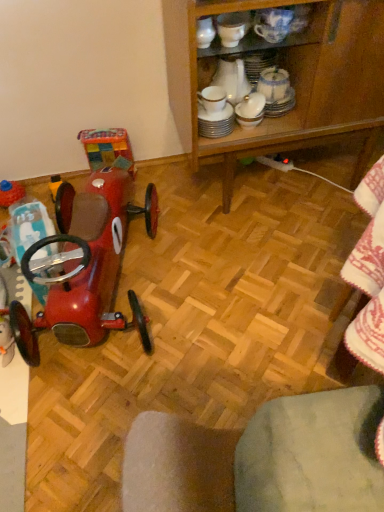
Question: From a real-world perspective, is shiny red car at left, the 1th toy from the left, under wooden cabinet at center?

Choices:
 (A) no
 (B) yes

Answer: (B)

Question: Does shiny red car at left, which ranks as the second toy in right-to-left order, have a lesser height compared to wooden cabinet at center?

Choices:
 (A) no
 (B) yes

Answer: (B)

Question: Is shiny red car at left, the second toy viewed from the front, outside of wooden cabinet at center?

Choices:
 (A) no
 (B) yes

Answer: (B)

Question: Is shiny red car at left, which is counted as the 1th toy, starting from the back, looking in the opposite direction of wooden cabinet at center?

Choices:
 (A) no
 (B) yes

Answer: (A)

Question: Can you confirm if shiny red car at left, the second toy viewed from the front, is taller than wooden cabinet at center?

Choices:
 (A) yes
 (B) no

Answer: (B)

Question: Considering the positions of wooden cabinet at center and shiny red car at left, the second toy viewed from the front, in the image, is wooden cabinet at center wider or thinner than shiny red car at left, the second toy viewed from the front,?

Choices:
 (A) thin
 (B) wide

Answer: (B)

Question: Is wooden cabinet at center in front of or behind shiny red car at left, the second toy viewed from the front, in the image?

Choices:
 (A) behind
 (B) front

Answer: (B)

Question: Considering the positions of wooden cabinet at center and shiny red car at left, the 1th toy from the left, in the image, is wooden cabinet at center taller or shorter than shiny red car at left, the 1th toy from the left,?

Choices:
 (A) short
 (B) tall

Answer: (B)

Question: From the image's perspective, is wooden cabinet at center positioned above or below shiny red car at left, the 1th toy from the left?

Choices:
 (A) above
 (B) below

Answer: (A)

Question: Is shiny red car at left, which is the 1th toy in right-to-left order, inside the boundaries of wooden cabinet at center, or outside?

Choices:
 (A) inside
 (B) outside

Answer: (B)

Question: Based on their sizes in the image, would you say shiny red car at left, which is the 1th toy in right-to-left order, is bigger or smaller than wooden cabinet at center?

Choices:
 (A) big
 (B) small

Answer: (B)

Question: Looking at their shapes, would you say shiny red car at left, acting as the second toy starting from the left, is wider or thinner than wooden cabinet at center?

Choices:
 (A) thin
 (B) wide

Answer: (B)

Question: From the image's perspective, relative to wooden cabinet at center, is shiny red car at left, which is the 1th toy in right-to-left order, above or below?

Choices:
 (A) above
 (B) below

Answer: (B)

Question: Considering the relative positions of wooden cabinet at center and shiny red car at left, arranged as the 2th toy when viewed from the back, in the image provided, is wooden cabinet at center to the left or to the right of shiny red car at left, arranged as the 2th toy when viewed from the back,?

Choices:
 (A) left
 (B) right

Answer: (B)

Question: From their relative heights in the image, would you say wooden cabinet at center is taller or shorter than shiny red car at left, arranged as the 2th toy when viewed from the back?

Choices:
 (A) tall
 (B) short

Answer: (A)